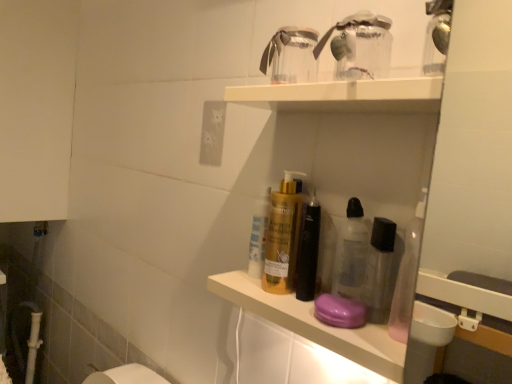
Question: Considering their positions, is transparent plastic shelf at upper center located in front of or behind white matte electric outlet at upper center?

Choices:
 (A) front
 (B) behind

Answer: (A)

Question: Is transparent plastic shelf at upper center taller or shorter than white matte electric outlet at upper center?

Choices:
 (A) tall
 (B) short

Answer: (A)

Question: Based on their sizes in the image, would you say transparent plastic shelf at upper center is bigger or smaller than white matte electric outlet at upper center?

Choices:
 (A) big
 (B) small

Answer: (A)

Question: In terms of height, does white matte electric outlet at upper center look taller or shorter compared to transparent plastic shelf at upper center?

Choices:
 (A) tall
 (B) short

Answer: (B)

Question: Is point (214, 127) positioned closer to the camera than point (415, 175)?

Choices:
 (A) closer
 (B) farther

Answer: (B)

Question: Visually, is white matte electric outlet at upper center positioned to the left or to the right of transparent plastic shelf at upper center?

Choices:
 (A) left
 (B) right

Answer: (A)

Question: From the image's perspective, relative to transparent plastic shelf at upper center, is white matte electric outlet at upper center above or below?

Choices:
 (A) below
 (B) above

Answer: (B)